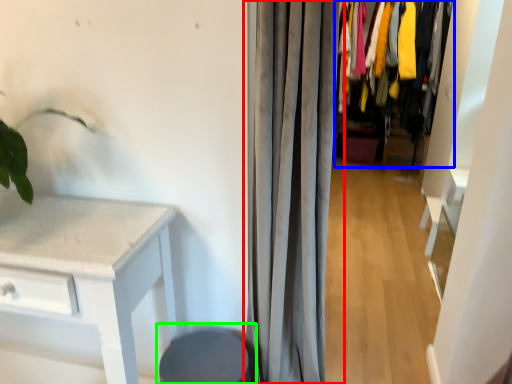
Question: Based on their relative distances, which object is farther from curtain (highlighted by a red box)? Choose from closet (highlighted by a blue box) and swivel chair (highlighted by a green box).

Choices:
 (A) closet
 (B) swivel chair

Answer: (A)